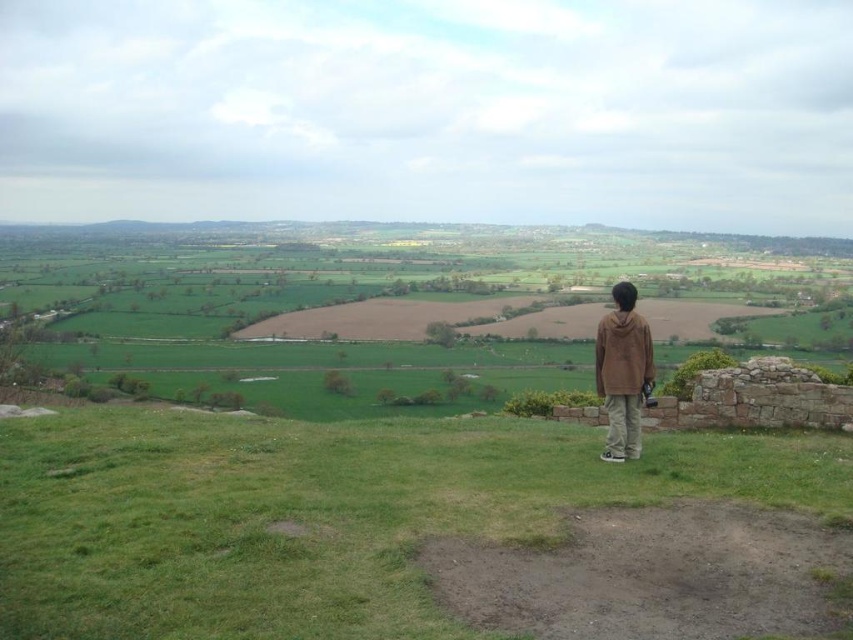
You are standing on the green grassy at center and want to move to the brown cotton hoodie at center. Is the path between them wide enough for you to walk through comfortably?

The green grassy at center might be wider than brown cotton hoodie at center, so the path between them could be wide enough for comfortable walking.

You are a photographer trying to capture the entire scene of the green grassy at center and the brown cotton hoodie at center in one shot. Given that your camera has a limited field of view, which object should you focus on to ensure both are visible without cropping?

The green grassy at center is larger in size than the brown cotton hoodie at center, so focusing on the green grassy at center would ensure both objects are visible in the frame.

You are standing at the top of a hill and see the green grassy at center and the brown cotton hoodie at center. Which object is nearer to you?

The green grassy at center is closer to the viewer than the brown cotton hoodie at center, so the green grassy at center is nearer to you.